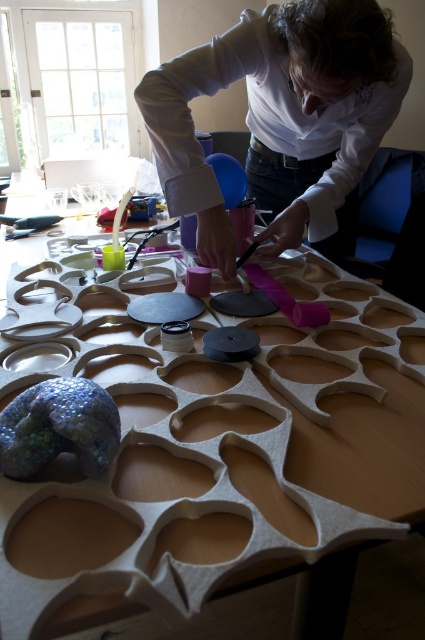
You are a guest in the room and want to place a small gift on the table. Since both the white matte table at center and the white matte shirt at upper center are visible, which one is closer to you so you can place the gift there?

The white matte table at center is closer to the viewer than the white matte shirt at upper center, so you should place the gift on the white matte table at center.

You are a guest in the room and want to place a small gift on the table without disturbing the person. Since the white matte shirt at upper center is in the way, can you place the gift on the white matte table at center from your current position?

The white matte table at center is to the left of the white matte shirt at upper center, so if you are positioned to the right of the shirt, you might have an unobstructed path to place the gift on the table. However, if the shirt blocks your line of sight or access, you may need to move around it to reach the table safely without disturbing the person.

You are a visitor observing the crafting scene. You notice the white matte table at center and the white matte shirt at upper center. Which object is located lower in the image?

The white matte table at center is positioned under the white matte shirt at upper center, so the table is lower than the shirt.